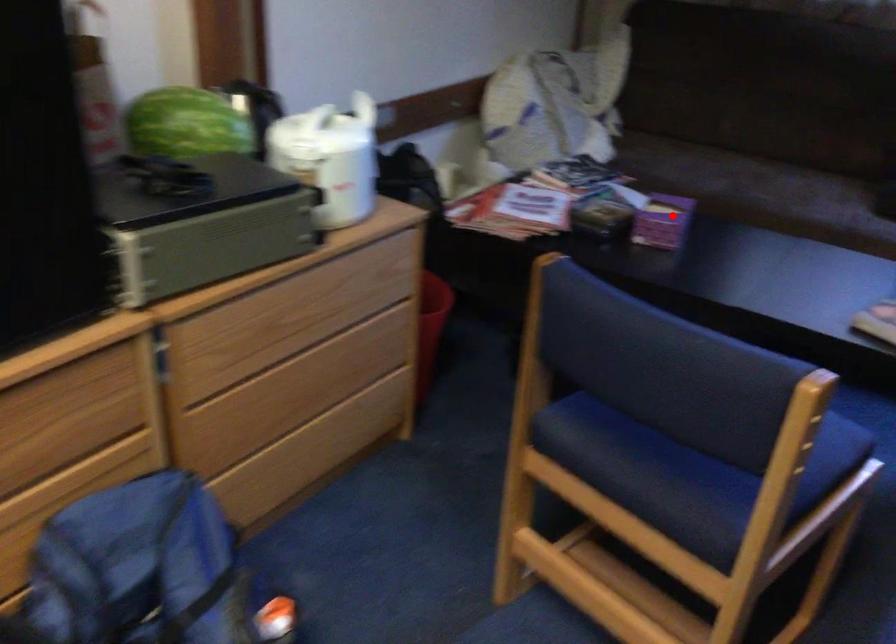
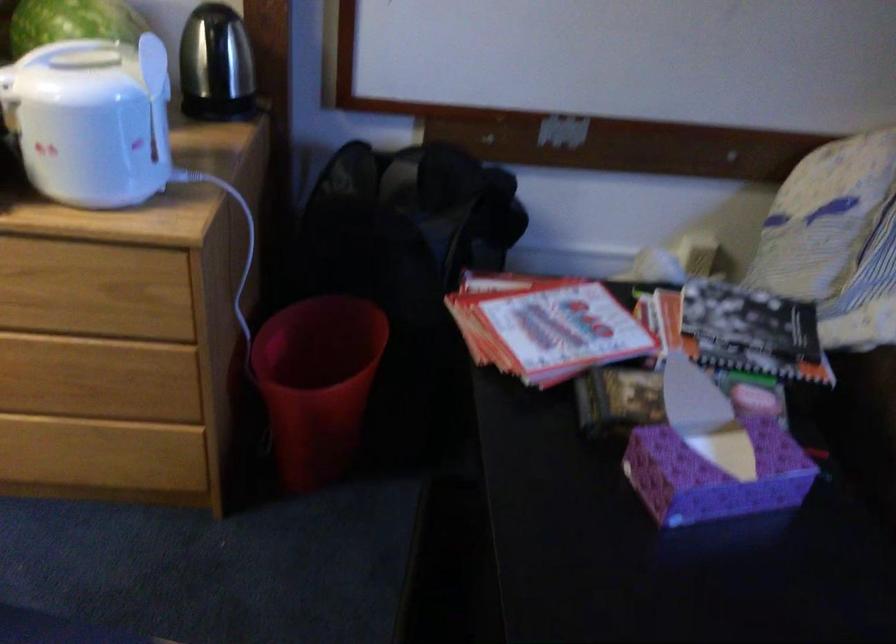
In the second image, find the point that corresponds to the highlighted location in the first image.

(714, 475)